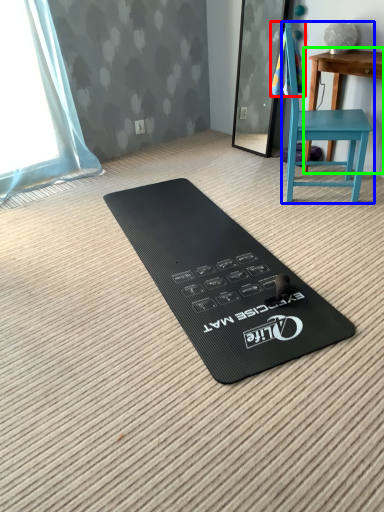
Question: Which object is the closest to the beach towel (highlighted by a red box)? Choose among these: chair (highlighted by a blue box) or table (highlighted by a green box).

Choices:
 (A) chair
 (B) table

Answer: (B)